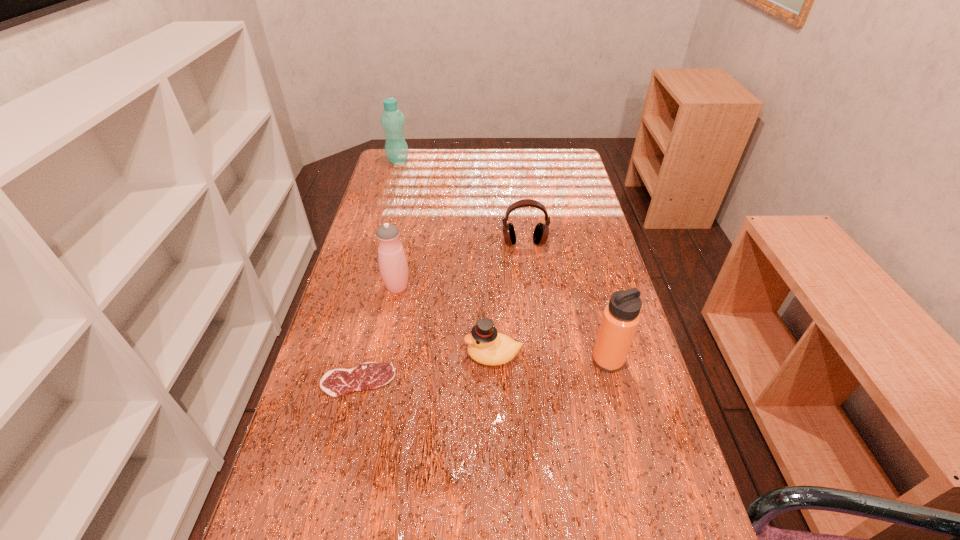
Identify the location of vacant area situated on the left of the right thermos bottle. This screenshot has height=540, width=960. (468, 360).

The width and height of the screenshot is (960, 540). Identify the location of blank area located on the front of the third farthest object. (383, 361).

Where is `vacant area situated 0.240m on the ear pads of the fourth tallest object`? Image resolution: width=960 pixels, height=540 pixels. vacant area situated 0.240m on the ear pads of the fourth tallest object is located at coordinates (532, 308).

Where is `free location located on the front-facing side of the fifth tallest object`? free location located on the front-facing side of the fifth tallest object is located at coordinates (380, 355).

Where is `vacant area situated on the front-facing side of the fifth tallest object`? vacant area situated on the front-facing side of the fifth tallest object is located at coordinates (406, 355).

Identify the location of vacant space located 0.300m on the front-facing side of the fifth tallest object. Image resolution: width=960 pixels, height=540 pixels. (338, 355).

You are a GUI agent. You are given a task and a screenshot of the screen. Output one action in this format:
    pyautogui.click(x=<x>, y=<y>)
    Task: Click on the free region located 0.330m on the back of the steak
    This screenshot has height=540, width=960.
    Given the screenshot: What is the action you would take?
    pyautogui.click(x=384, y=269)

Locate an element on the screen. object at the far edge is located at coordinates (392, 120).

You are a GUI agent. You are given a task and a screenshot of the screen. Output one action in this format:
    pyautogui.click(x=<x>, y=<y>)
    Task: Click on the bottle situated at the left edge
    The height and width of the screenshot is (540, 960).
    Given the screenshot: What is the action you would take?
    pyautogui.click(x=392, y=120)

Where is `thermos bottle that is positioned at the left edge`? thermos bottle that is positioned at the left edge is located at coordinates (393, 265).